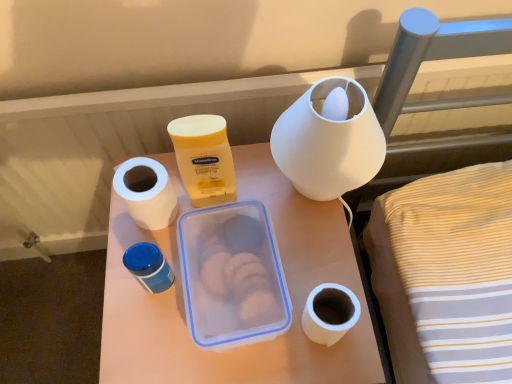
Where is `free spot in front of blue plastic container at center-left, which is the 1th pottery from bottom to top`? Image resolution: width=512 pixels, height=384 pixels. free spot in front of blue plastic container at center-left, which is the 1th pottery from bottom to top is located at coordinates (166, 340).